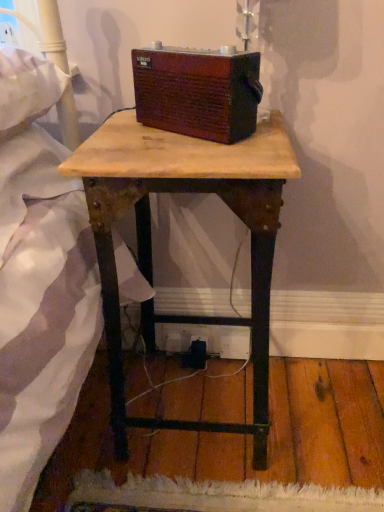
At what (x,y) coordinates should I click in order to perform the action: click on blank space to the left of brown wood radio at center. Please return your answer as a coordinate pair (x, y). The image size is (384, 512). Looking at the image, I should click on (127, 133).